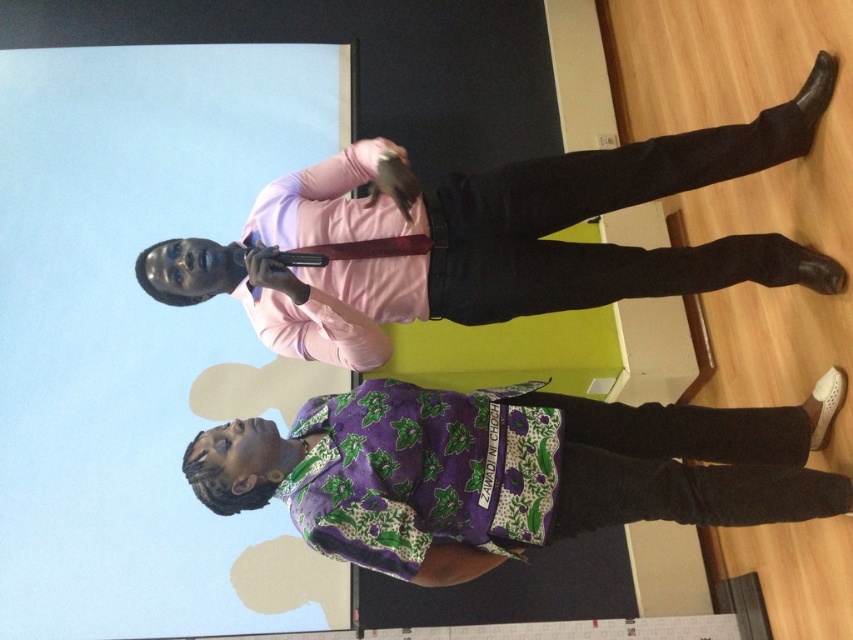
Is point (529, 488) behind point (462, 522)?

No, (529, 488) is closer to viewer.

What do you see at coordinates (505, 472) in the screenshot? This screenshot has height=640, width=853. I see `purple printed shirt at center` at bounding box center [505, 472].

Which is behind, point (695, 486) or point (502, 502)?

Positioned behind is point (695, 486).

This screenshot has width=853, height=640. What are the coordinates of `purple printed shirt at center` in the screenshot? It's located at (505, 472).

Does point (584, 420) lie behind point (292, 296)?

Yes, it is behind point (292, 296).

Between purple printed shirt at center and pink satin shirt at upper center, which one is positioned higher?

pink satin shirt at upper center

Find the location of `purple printed shirt at center`. purple printed shirt at center is located at coordinates (505, 472).

Who is more forward, (276, 285) or (363, 513)?

Positioned in front is point (363, 513).

Who is taller, pink satin shirt at upper center or purple batik dress at lower center?

Standing taller between the two is pink satin shirt at upper center.

Between point (347, 269) and point (396, 547), which one is positioned behind?

The point (347, 269) is more distant.

You are a GUI agent. You are given a task and a screenshot of the screen. Output one action in this format:
    pyautogui.click(x=<x>, y=<y>)
    Task: Click on the pink satin shirt at upper center
    This screenshot has width=853, height=640.
    Given the screenshot: What is the action you would take?
    pyautogui.click(x=492, y=237)